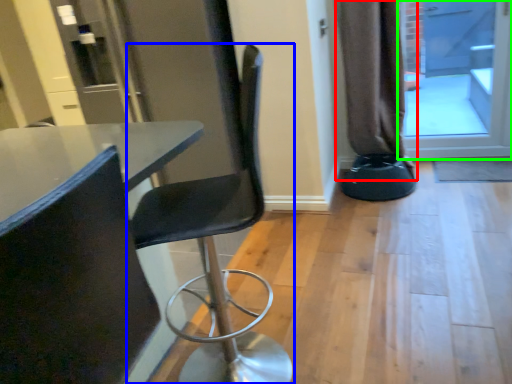
Question: Based on their relative distances, which object is farther from curtain (highlighted by a red box)? Choose from chair (highlighted by a blue box) and screen door (highlighted by a green box).

Choices:
 (A) chair
 (B) screen door

Answer: (A)